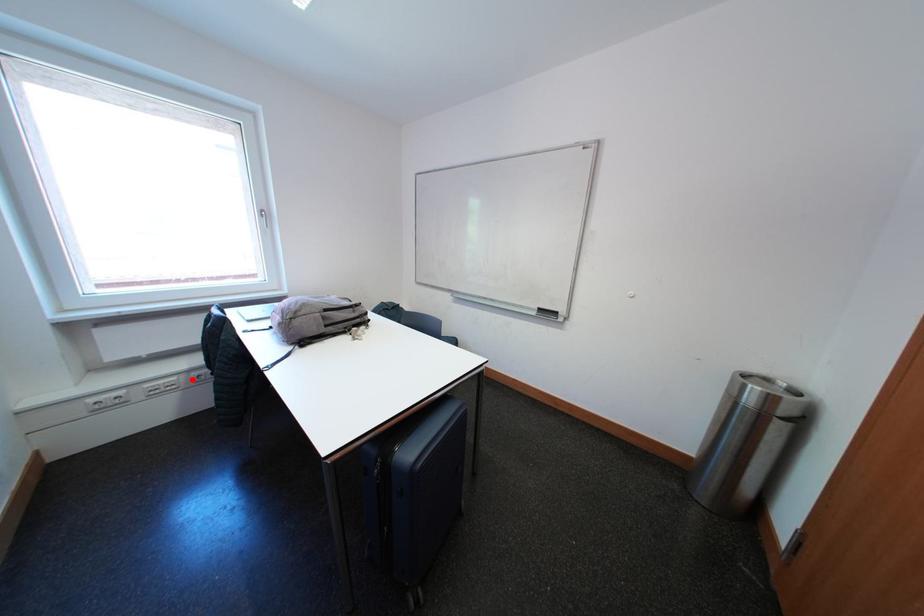
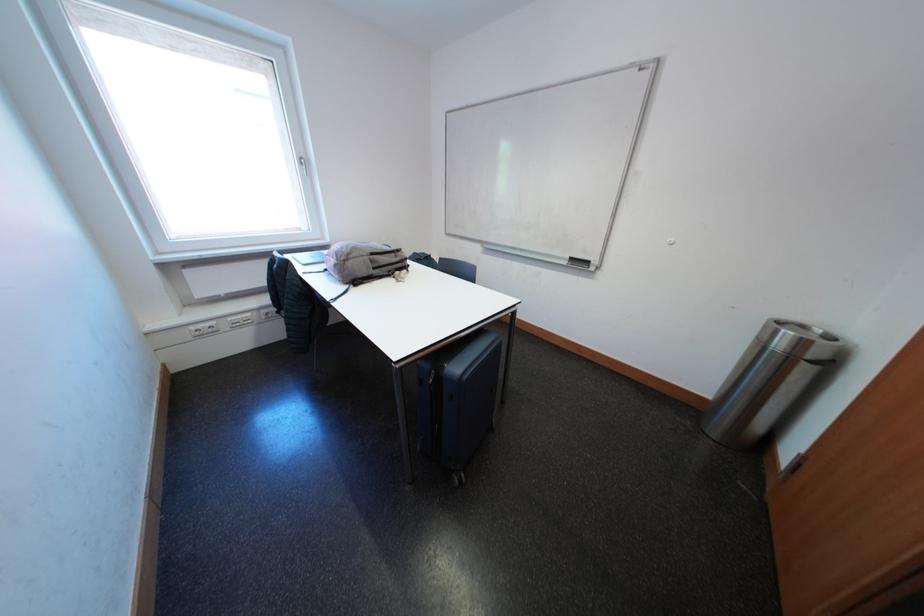
Question: I am providing you with two images of the same scene from different viewpoints. Given a red point in image1, look at the same physical point in image2. Is it:

Choices:
 (A) Closer to the viewpoint
 (B) Farther from the viewpoint

Answer: (B)